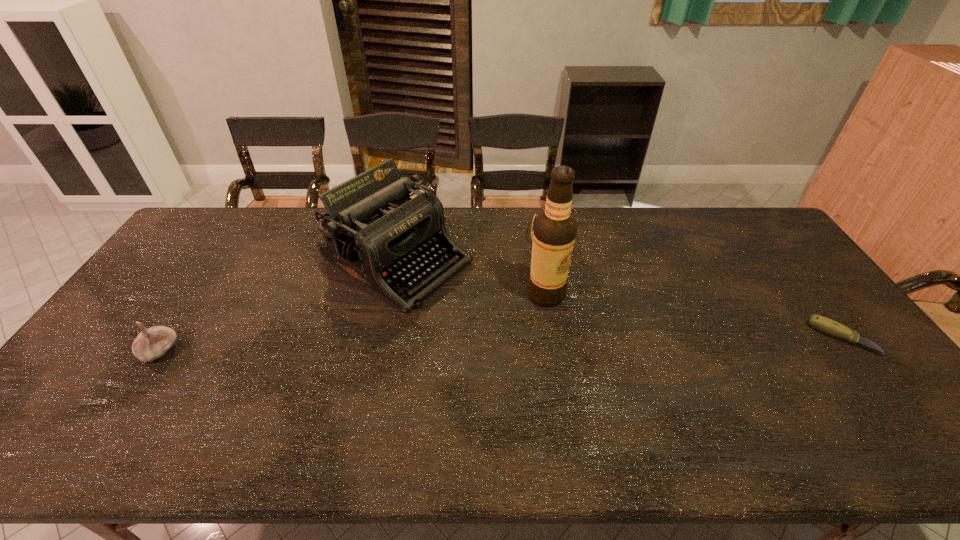
Locate an element on the screen. sunglasses situated at the far edge is located at coordinates (536, 215).

You are a GUI agent. You are given a task and a screenshot of the screen. Output one action in this format:
    pyautogui.click(x=<x>, y=<y>)
    Task: Click on the object that is at the left edge
    
    Given the screenshot: What is the action you would take?
    pyautogui.click(x=150, y=344)

What are the coordinates of `object at the right edge` in the screenshot? It's located at (828, 326).

Where is `vacant point at the far edge`? This screenshot has height=540, width=960. vacant point at the far edge is located at coordinates (711, 228).

Identify the location of vacant space at the near edge. (524, 384).

Locate an element on the screen. Image resolution: width=960 pixels, height=540 pixels. free space at the left edge is located at coordinates (209, 258).

This screenshot has height=540, width=960. Identify the location of vacant space at the right edge of the desktop. (828, 370).

At what (x,y) coordinates should I click in order to perform the action: click on free space at the near left corner. Please return your answer as a coordinate pair (x, y). Looking at the image, I should click on (76, 384).

This screenshot has height=540, width=960. I want to click on vacant area that lies between the garlic and the tallest object, so click(353, 322).

At what (x,y) coordinates should I click in order to perform the action: click on vacant region between the second tallest object and the tallest object. Please return your answer as a coordinate pair (x, y). The image size is (960, 540). Looking at the image, I should click on (471, 277).